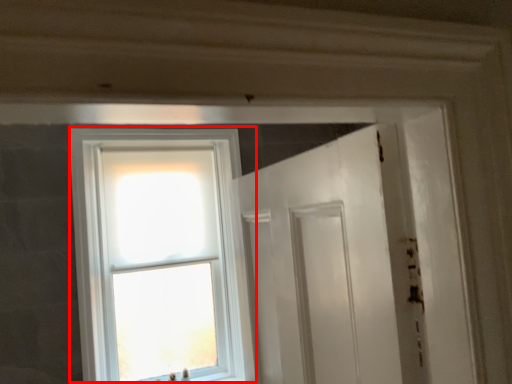
Question: From the image's perspective, what is the correct spatial positioning of window (annotated by the red box) in reference to screen door?

Choices:
 (A) below
 (B) above

Answer: (B)